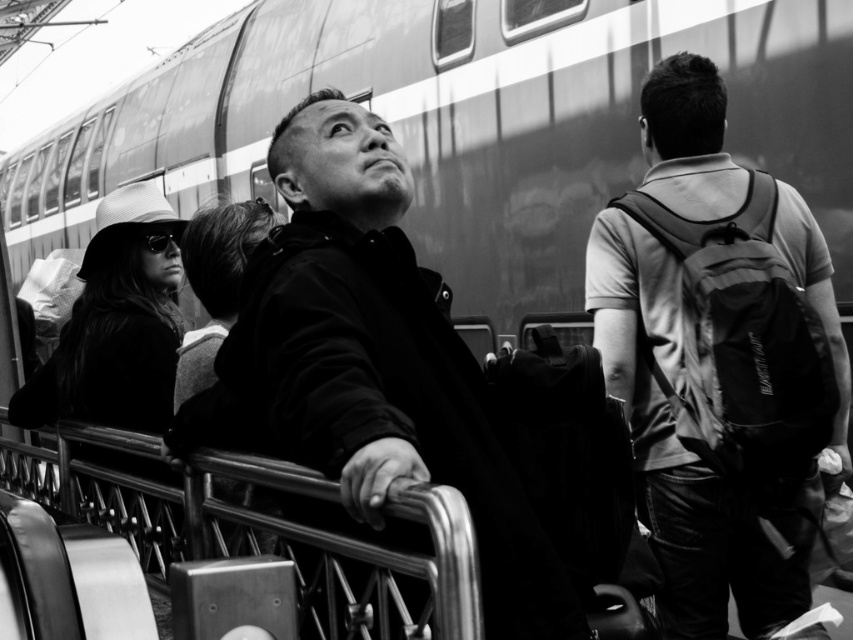
In the scene shown: Who is shorter, matte black jacket at center or matte black backpack at center?

matte black jacket at center is shorter.

Does point (431, 481) come farther from viewer compared to point (747, 524)?

No.

Find the location of a particular element. matte black jacket at center is located at coordinates (372, 364).